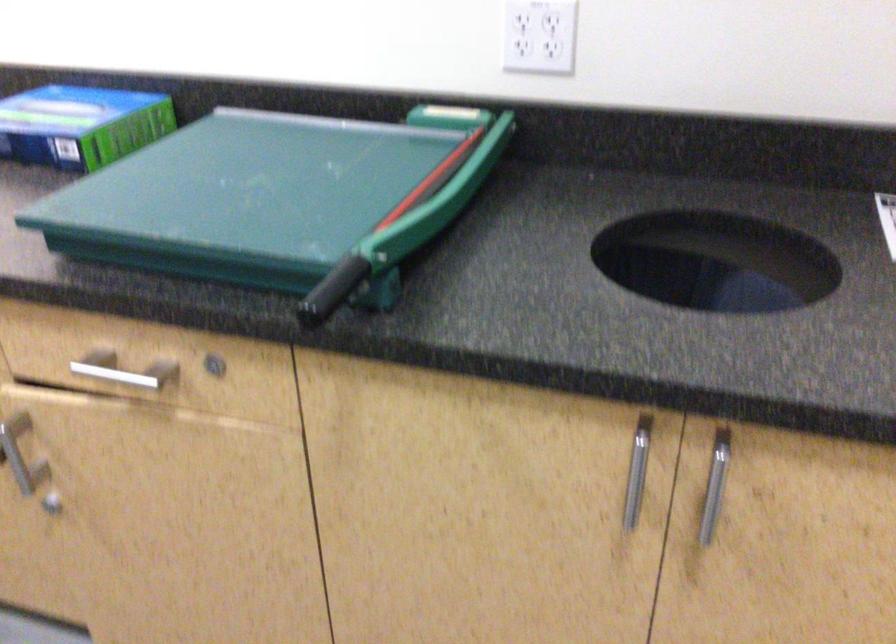
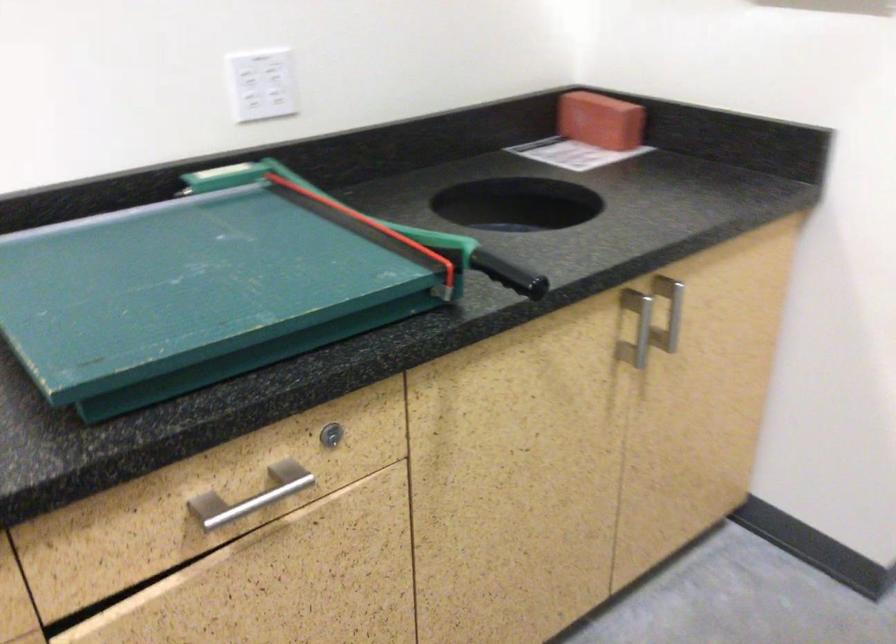
Find the pixel in the second image that matches [151,370] in the first image.

(251, 496)